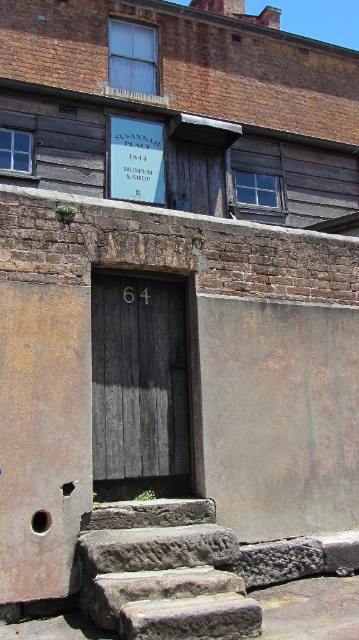
Is rusty stone stairs at lower left to the left of weathered wood door at center from the viewer's perspective?

In fact, rusty stone stairs at lower left is to the right of weathered wood door at center.

Who is higher up, rusty stone stairs at lower left or weathered wood door at center?

weathered wood door at center is higher up.

Who is more forward, (117, 609) or (174, 368)?

Point (117, 609) is more forward.

Locate an element on the screen. rusty stone stairs at lower left is located at coordinates (162, 572).